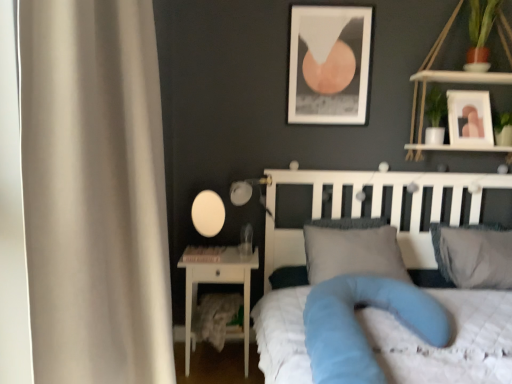
Question: Is white wood shelf at upper right wider or thinner than white quilted bed at center?

Choices:
 (A) wide
 (B) thin

Answer: (B)

Question: Based on their positions, is white wood shelf at upper right located to the left or right of white quilted bed at center?

Choices:
 (A) right
 (B) left

Answer: (A)

Question: Which of these objects is positioned farthest from the gray fabric pillow at right, the 1th pillow from the right?

Choices:
 (A) blue fabric mattress at center
 (B) white glossy nightstand at lower left
 (C) gray fabric pillow at center, placed as the 1th pillow when sorted from left to right
 (D) white fabric curtain at left
 (E) white quilted bed at center

Answer: (D)

Question: Estimate the real-world distances between objects in this image. Which object is farther from the gray fabric pillow at center, the second pillow viewed from the right?

Choices:
 (A) gray fabric pillow at right, which is counted as the 2th pillow, starting from the left
 (B) white quilted bed at center
 (C) blue fabric mattress at center
 (D) white wood shelf at upper right
 (E) white matte picture frame at upper right, the 2th picture frame from the left

Answer: (E)